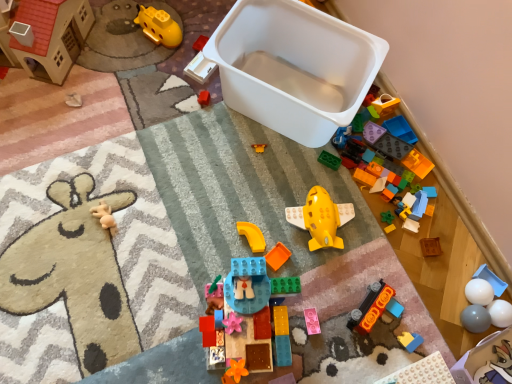
Identify the location of vacant area located to the right-hand side of pink matte block at center, the tenth toy positioned from the right. (368, 332).